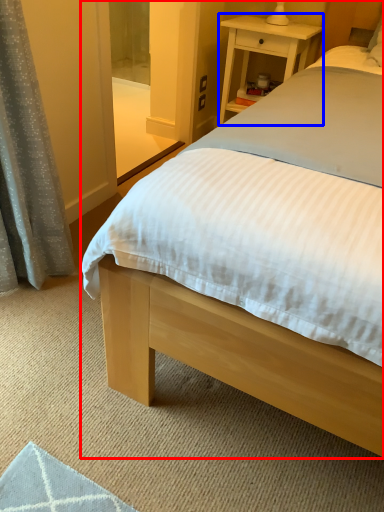
Question: Which object appears farthest to the camera in this image, bed (highlighted by a red box) or nightstand (highlighted by a blue box)?

Choices:
 (A) bed
 (B) nightstand

Answer: (B)